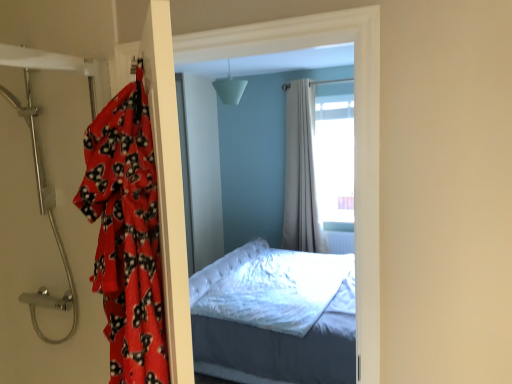
Question: From the image's perspective, would you say metallic showerhead at left is shown under fluffy red blanket at left?

Choices:
 (A) no
 (B) yes

Answer: (A)

Question: Is metallic showerhead at left positioned with its back to fluffy red blanket at left?

Choices:
 (A) no
 (B) yes

Answer: (A)

Question: Can you confirm if metallic showerhead at left is thinner than fluffy red blanket at left?

Choices:
 (A) no
 (B) yes

Answer: (A)

Question: From a real-world perspective, is metallic showerhead at left on top of fluffy red blanket at left?

Choices:
 (A) yes
 (B) no

Answer: (A)

Question: Is metallic showerhead at left at the left side of fluffy red blanket at left?

Choices:
 (A) no
 (B) yes

Answer: (B)

Question: Would you say metallic showerhead at left is a long distance from fluffy red blanket at left?

Choices:
 (A) no
 (B) yes

Answer: (A)

Question: Is fluffy red blanket at left closer to the viewer compared to metallic showerhead at left?

Choices:
 (A) no
 (B) yes

Answer: (B)

Question: Considering the relative sizes of fluffy red blanket at left and metallic showerhead at left in the image provided, is fluffy red blanket at left shorter than metallic showerhead at left?

Choices:
 (A) yes
 (B) no

Answer: (A)

Question: From a real-world perspective, does fluffy red blanket at left sit lower than metallic showerhead at left?

Choices:
 (A) yes
 (B) no

Answer: (A)

Question: Considering the relative sizes of fluffy red blanket at left and metallic showerhead at left in the image provided, is fluffy red blanket at left wider than metallic showerhead at left?

Choices:
 (A) no
 (B) yes

Answer: (A)

Question: Is fluffy red blanket at left aimed at metallic showerhead at left?

Choices:
 (A) no
 (B) yes

Answer: (A)

Question: Does fluffy red blanket at left appear on the right side of metallic showerhead at left?

Choices:
 (A) no
 (B) yes

Answer: (B)

Question: Does fluffy red blanket at left have a smaller size compared to beige fabric curtain at center?

Choices:
 (A) no
 (B) yes

Answer: (B)